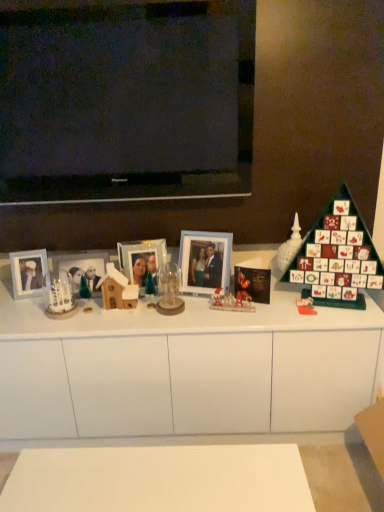
This screenshot has height=512, width=384. Find the location of `free location in front of matte plastic toy at right, the 5th toy viewed from the left`. free location in front of matte plastic toy at right, the 5th toy viewed from the left is located at coordinates (314, 320).